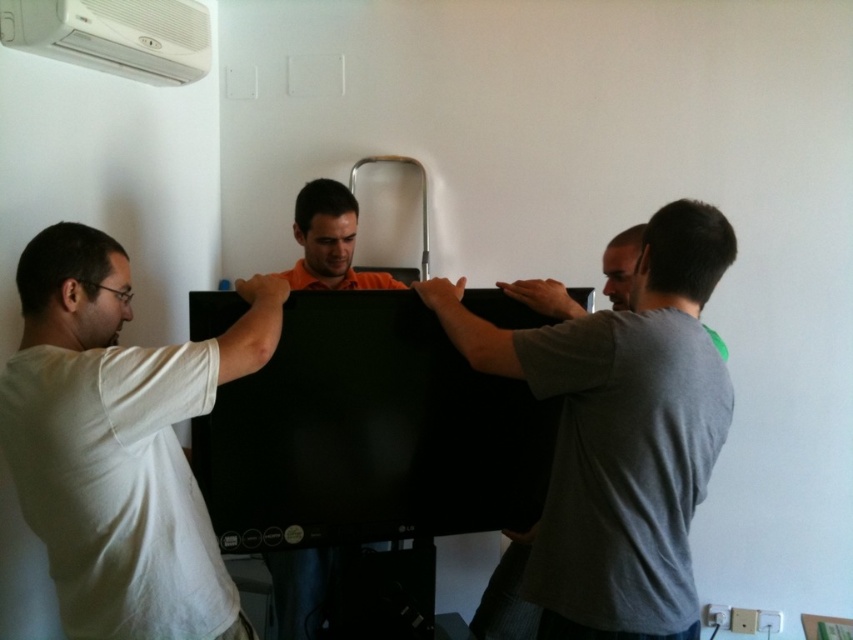
Question: Based on their relative distances, which object is nearer to the orange matte shirt at center?

Choices:
 (A) white matte shirt at left
 (B) gray matte shirt at right

Answer: (A)

Question: Among these objects, which one is farthest from the camera?

Choices:
 (A) orange matte shirt at center
 (B) white matte shirt at left

Answer: (A)

Question: Is gray matte shirt at right behind white plastic air conditioning unit at upper left?

Choices:
 (A) yes
 (B) no

Answer: (B)

Question: Is white matte shirt at left bigger than gray matte shirt at right?

Choices:
 (A) no
 (B) yes

Answer: (A)

Question: Is white matte shirt at left below orange matte shirt at center?

Choices:
 (A) yes
 (B) no

Answer: (A)

Question: Which of the following is the farthest from the observer?

Choices:
 (A) (170, 452)
 (B) (86, 22)
 (C) (686, 580)
 (D) (300, 262)

Answer: (D)